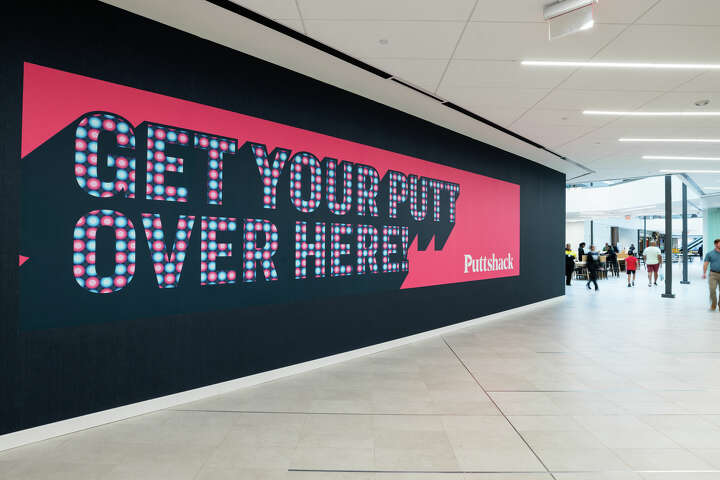
Where is `ceiling`? ceiling is located at coordinates (438, 44).